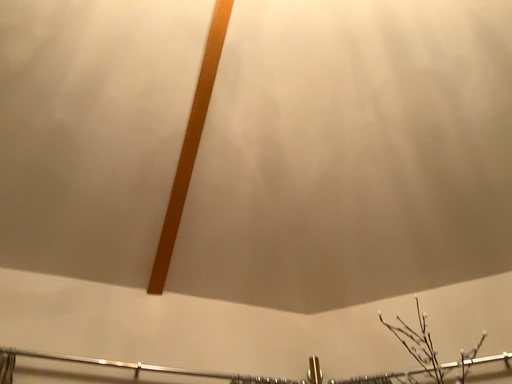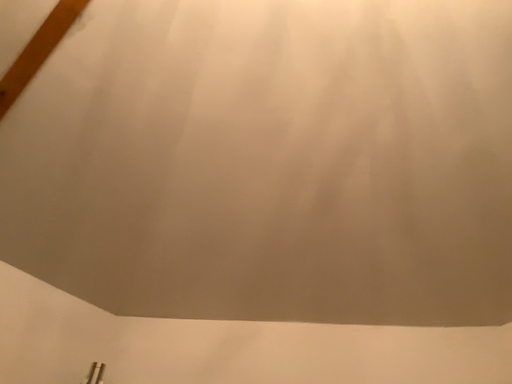
Question: Which way did the camera rotate in the video?

Choices:
 (A) rotated upward
 (B) rotated downward

Answer: (B)